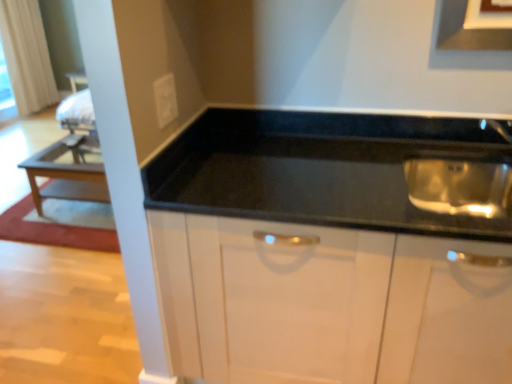
What do you see at coordinates (27, 55) in the screenshot? I see `white fabric curtain at upper left` at bounding box center [27, 55].

Measure the distance between point (x=36, y=76) and camera.

Point (x=36, y=76) and camera are 17.08 feet apart from each other.

This screenshot has width=512, height=384. What do you see at coordinates (66, 175) in the screenshot?
I see `wooden table at left` at bounding box center [66, 175].

Locate an element on the screen. This screenshot has width=512, height=384. matte black exhaust hood at upper center is located at coordinates (468, 31).

Where is `white fabric curtain at upper left`? Image resolution: width=512 pixels, height=384 pixels. white fabric curtain at upper left is located at coordinates (27, 55).

From the image's perspective, which is above, white fabric curtain at upper left or matte black exhaust hood at upper center?

white fabric curtain at upper left is shown above in the image.

Is white fabric curtain at upper left surrounding matte black exhaust hood at upper center?

No, matte black exhaust hood at upper center is not inside white fabric curtain at upper left.

Does point (28, 95) come closer to viewer compared to point (454, 44)?

No, (28, 95) is behind (454, 44).

From a real-world perspective, is white fabric curtain at upper left positioned over matte black exhaust hood at upper center based on gravity?

Actually, white fabric curtain at upper left is physically below matte black exhaust hood at upper center in the real world.

Could you tell me if matte black exhaust hood at upper center is turned towards black glossy cabinet at center?

No, matte black exhaust hood at upper center does not turn towards black glossy cabinet at center.

Based on the photo, is matte black exhaust hood at upper center with black glossy cabinet at center?

No.

Is matte black exhaust hood at upper center positioned beyond the bounds of black glossy cabinet at center?

Yes, matte black exhaust hood at upper center is located beyond the bounds of black glossy cabinet at center.

I want to click on exhaust hood positioned vertically above the black glossy cabinet at center (from a real-world perspective), so click(x=468, y=31).

Based on the photo, from the image's perspective, which object appears higher, matte black exhaust hood at upper center or wooden table at left?

matte black exhaust hood at upper center, from the image's perspective.

Which object is positioned more to the right, matte black exhaust hood at upper center or wooden table at left?

matte black exhaust hood at upper center.

Between matte black exhaust hood at upper center and wooden table at left, which one has smaller width?

matte black exhaust hood at upper center.

Which object is more forward, matte black exhaust hood at upper center or wooden table at left?

matte black exhaust hood at upper center is in front.

In the image, is white fabric curtain at upper left on the left side or the right side of black glossy cabinet at center?

Based on their positions, white fabric curtain at upper left is located to the left of black glossy cabinet at center.

The height and width of the screenshot is (384, 512). In the image, there is a white fabric curtain at upper left. Identify the location of cabinetry below it (from the image's perspective). (328, 304).

Looking at this image, can you confirm if white fabric curtain at upper left is shorter than black glossy cabinet at center?

In fact, white fabric curtain at upper left may be taller than black glossy cabinet at center.

Does black glossy cabinet at center touch wooden table at left?

No.

Could you tell me if black glossy cabinet at center is facing wooden table at left?

No, black glossy cabinet at center is not facing towards wooden table at left.

Which object is wider, black glossy cabinet at center or wooden table at left?

black glossy cabinet at center is wider.

Can you tell me how much black glossy cabinet at center and wooden table at left differ in facing direction?

There is a 0.864-degree angle between the facing directions of black glossy cabinet at center and wooden table at left.

Locate an element on the screen. The width and height of the screenshot is (512, 384). curtain located behind the matte black exhaust hood at upper center is located at coordinates (27, 55).

Between matte black exhaust hood at upper center and white fabric curtain at upper left, which one is positioned in front?

Positioned in front is matte black exhaust hood at upper center.

From the image's perspective, between matte black exhaust hood at upper center and white fabric curtain at upper left, which one is located above?

white fabric curtain at upper left appears higher in the image.

In terms of width, does matte black exhaust hood at upper center look wider or thinner when compared to white fabric curtain at upper left?

In the image, matte black exhaust hood at upper center appears to be more narrow than white fabric curtain at upper left.

Based on the photo, is black glossy cabinet at center in contact with matte black exhaust hood at upper center?

No.

Is black glossy cabinet at center facing away from matte black exhaust hood at upper center?

No, black glossy cabinet at center is not facing the opposite direction of matte black exhaust hood at upper center.

From the image's perspective, which is above, black glossy cabinet at center or matte black exhaust hood at upper center?

matte black exhaust hood at upper center.

Which is more to the right, black glossy cabinet at center or matte black exhaust hood at upper center?

matte black exhaust hood at upper center.

Where is `exhaust hood in front of the white fabric curtain at upper left`? Image resolution: width=512 pixels, height=384 pixels. exhaust hood in front of the white fabric curtain at upper left is located at coordinates (468, 31).

Locate an element on the screen. Image resolution: width=512 pixels, height=384 pixels. exhaust hood above the black glossy cabinet at center (from the image's perspective) is located at coordinates (468, 31).

Based on their spatial positions, is black glossy cabinet at center or white fabric curtain at upper left closer to wooden table at left?

black glossy cabinet at center lies closer to wooden table at left than the other object.

From the image, which object appears to be nearer to white fabric curtain at upper left, wooden table at left or black glossy cabinet at center?

wooden table at left lies closer to white fabric curtain at upper left than the other object.

When comparing their distances from white fabric curtain at upper left, does wooden table at left or matte black exhaust hood at upper center seem closer?

Among the two, wooden table at left is located nearer to white fabric curtain at upper left.

Looking at the image, which one is located closer to white fabric curtain at upper left, black glossy cabinet at center or matte black exhaust hood at upper center?

black glossy cabinet at center lies closer to white fabric curtain at upper left than the other object.

When comparing their distances from wooden table at left, does white fabric curtain at upper left or matte black exhaust hood at upper center seem closer?

Based on the image, white fabric curtain at upper left appears to be nearer to wooden table at left.

Estimate the real-world distances between objects in this image. Which object is further from matte black exhaust hood at upper center, white fabric curtain at upper left or black glossy cabinet at center?

The object further to matte black exhaust hood at upper center is white fabric curtain at upper left.

In the scene shown: Which object lies further to the anchor point black glossy cabinet at center, matte black exhaust hood at upper center or white fabric curtain at upper left?

white fabric curtain at upper left lies further to black glossy cabinet at center than the other object.

When comparing their distances from wooden table at left, does matte black exhaust hood at upper center or black glossy cabinet at center seem further?

Based on the image, matte black exhaust hood at upper center appears to be further to wooden table at left.

What are the coordinates of `exhaust hood between black glossy cabinet at center and white fabric curtain at upper left from front to back` in the screenshot? It's located at (468, 31).

Locate an element on the screen. This screenshot has width=512, height=384. cabinetry situated between wooden table at left and matte black exhaust hood at upper center from left to right is located at coordinates (328, 304).

Find the location of a particular element. The width and height of the screenshot is (512, 384). table positioned between black glossy cabinet at center and white fabric curtain at upper left from near to far is located at coordinates (66, 175).

Where is `table between white fabric curtain at upper left and matte black exhaust hood at upper center in the horizontal direction`? This screenshot has width=512, height=384. table between white fabric curtain at upper left and matte black exhaust hood at upper center in the horizontal direction is located at coordinates point(66,175).